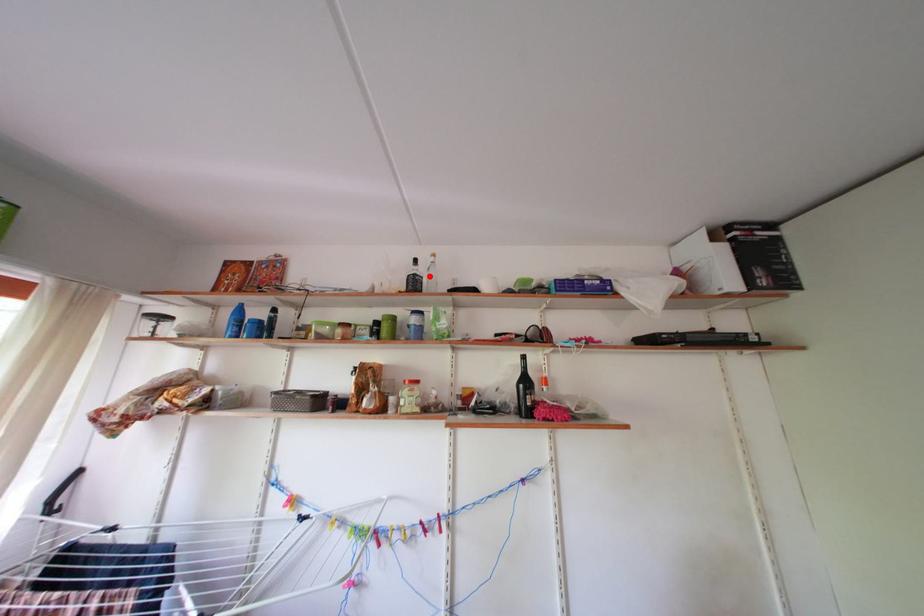
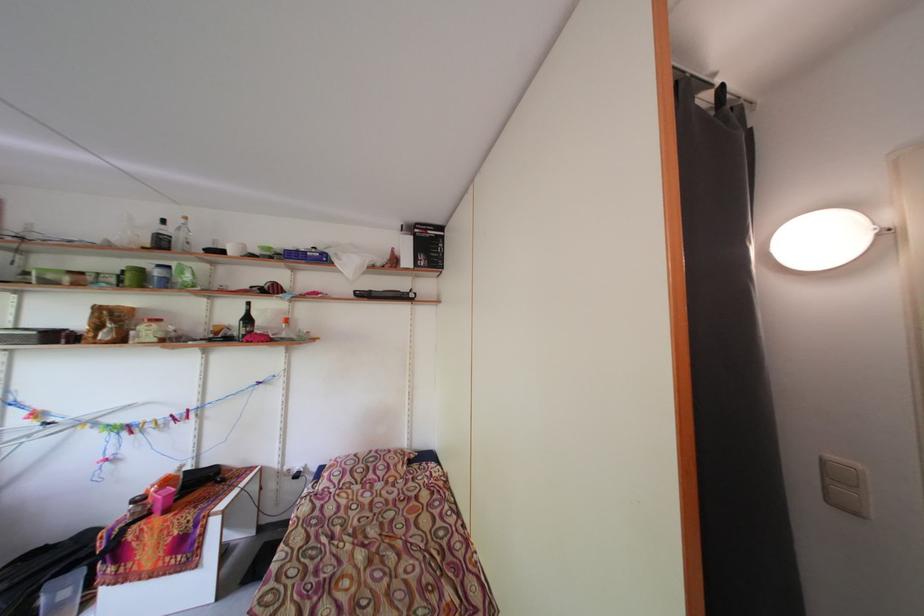
In the second image, find the point that corresponds to the highlighted location in the first image.

(176, 236)